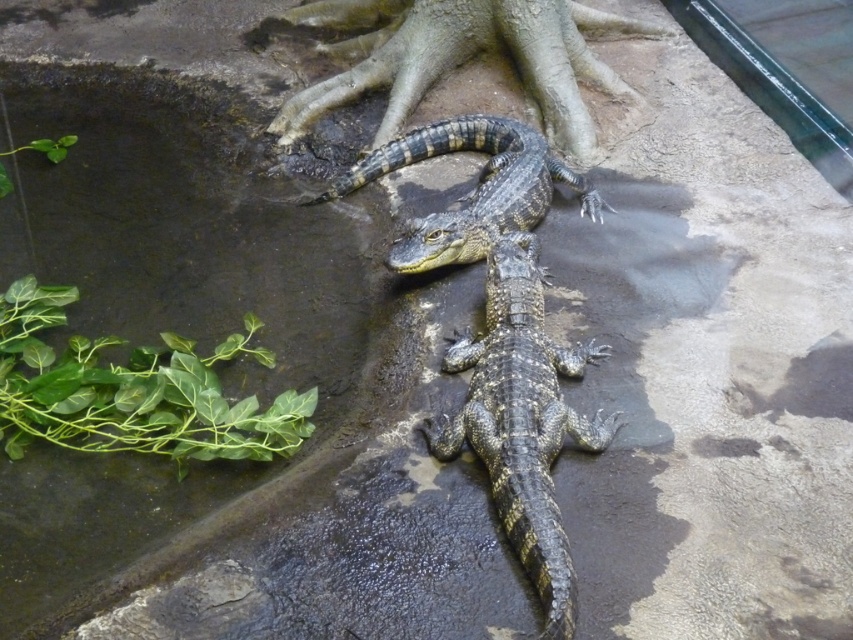
Who is lower down, shiny black crocodile at center or shiny dark green crocodile at center?

Positioned lower is shiny dark green crocodile at center.

Can you confirm if shiny black crocodile at center is shorter than shiny dark green crocodile at center?

Incorrect, shiny black crocodile at center's height does not fall short of shiny dark green crocodile at center's.

Between point (509, 182) and point (485, 305), which one is positioned in front?

Point (485, 305) is in front.

You are a GUI agent. You are given a task and a screenshot of the screen. Output one action in this format:
    pyautogui.click(x=<x>, y=<y>)
    Task: Click on the shiny black crocodile at center
    
    Given the screenshot: What is the action you would take?
    pyautogui.click(x=502, y=332)